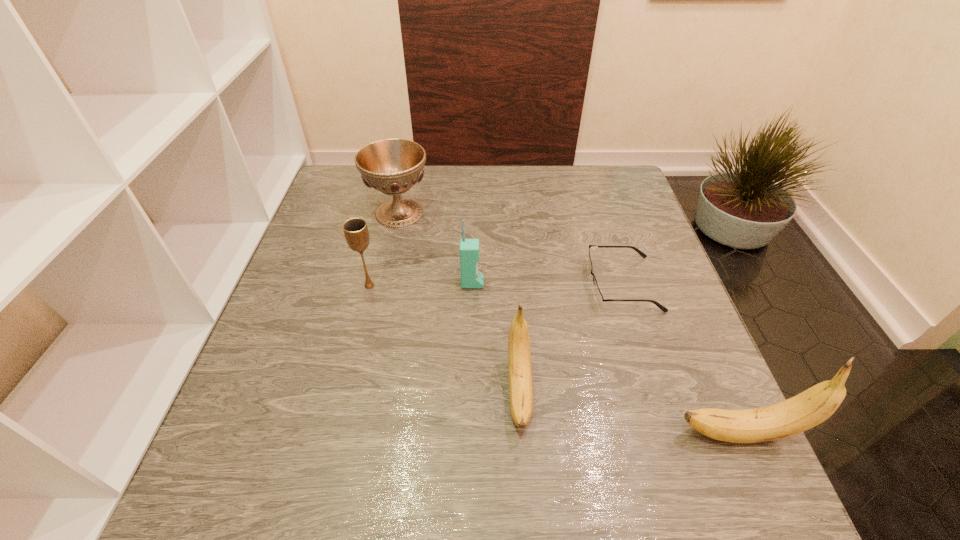
Please show where to add a banana on the left while keeping spacing even. Please provide its 2D coordinates. Your answer should be formatted as a tuple, i.e. [(x, y)], where the tuple contains the x and y coordinates of a point satisfying the conditions above.

[(327, 355)]